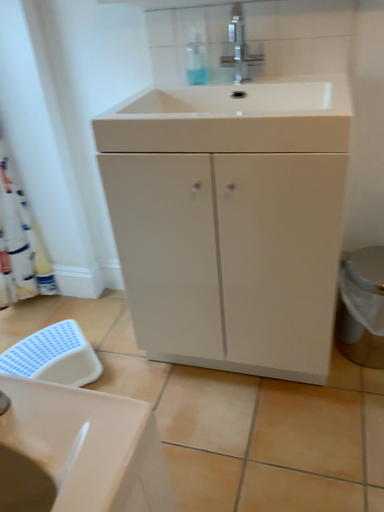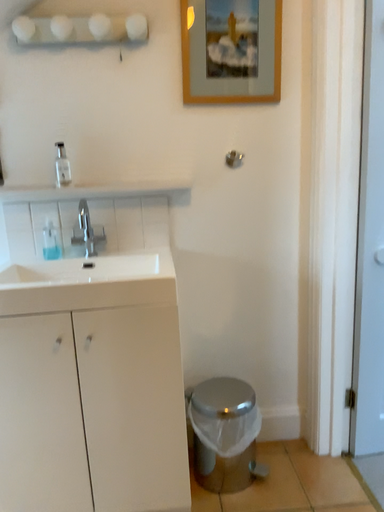
Question: How did the camera likely rotate when shooting the video?

Choices:
 (A) rotated upward
 (B) rotated downward

Answer: (A)